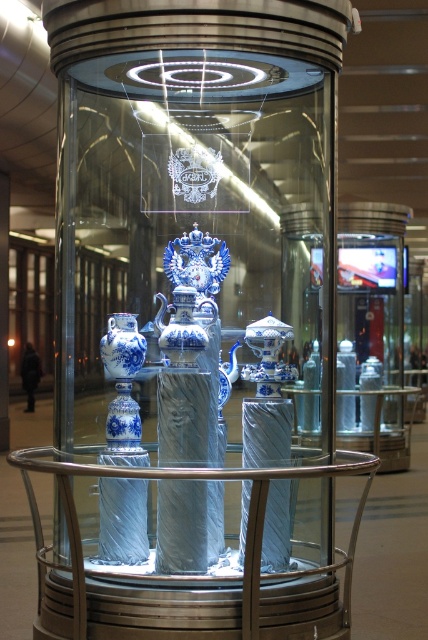
Can you confirm if blue porcelain teapot at center is taller than blue porcelain vase at center?

Indeed, blue porcelain teapot at center has a greater height compared to blue porcelain vase at center.

Who is more forward, (177, 332) or (109, 352)?

Point (177, 332) is in front.

The width and height of the screenshot is (428, 640). I want to click on blue porcelain teapot at center, so click(x=180, y=328).

Does clear glass table at center have a lesser width compared to blue porcelain teapot at center?

No, clear glass table at center is not thinner than blue porcelain teapot at center.

Is point (347, 584) farther from camera compared to point (196, 356)?

No, (347, 584) is in front of (196, 356).

The width and height of the screenshot is (428, 640). Find the location of `clear glass table at center`. clear glass table at center is located at coordinates (190, 477).

Where is `clear glass table at center`? clear glass table at center is located at coordinates (190, 477).

Between point (41, 541) and point (142, 362), which one is positioned behind?

The point (142, 362) is more distant.

Does clear glass table at center have a lesser width compared to blue porcelain vase at center?

In fact, clear glass table at center might be wider than blue porcelain vase at center.

At what (x,y) coordinates should I click in order to perform the action: click on clear glass table at center. Please return your answer as a coordinate pair (x, y). Looking at the image, I should click on (190, 477).